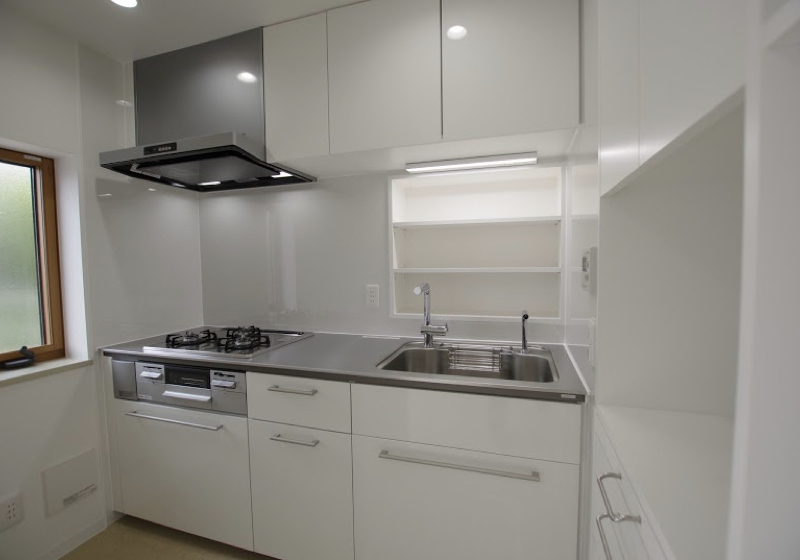
This screenshot has height=560, width=800. I want to click on window, so click(x=10, y=295).